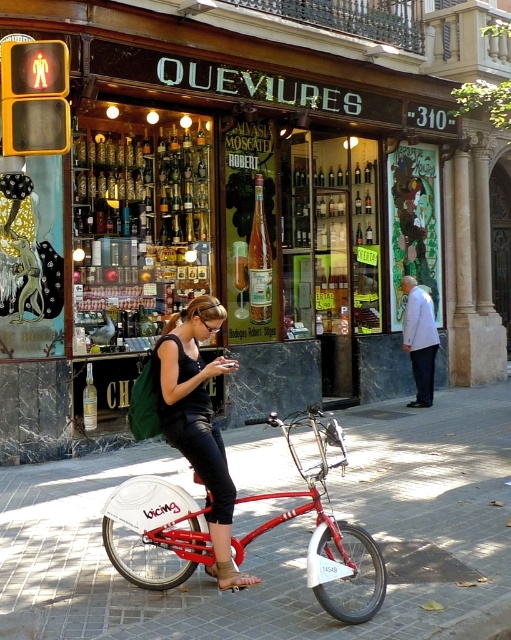
You are standing in front of the wine shop and see the brick pavement at center and the shiny red bicycle at center. Which object is closer to the ground?

The brick pavement at center is located below the shiny red bicycle at center, so the brick pavement at center is closer to the ground.

You are a delivery person who needs to pick up a package from the wine shop. You see the shiny red bicycle at center and the matte black tank top at center. Which object is closer to the shop entrance?

The shiny red bicycle at center is positioned under the matte black tank top at center, which means the bicycle is closer to the shop entrance than the tank top.

What is the 2D coordinate of the brick pavement at center?

The brick pavement at center is located at the 2D coordinate point of (277, 536).